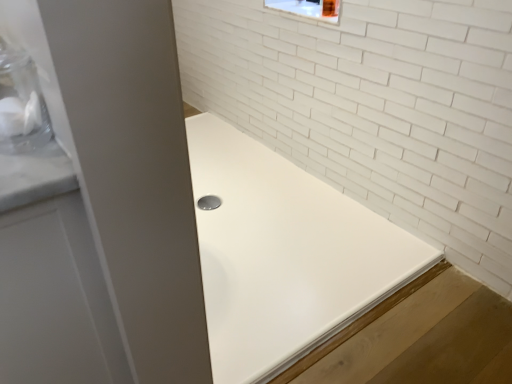
Describe the element at coordinates (19, 115) in the screenshot. The width and height of the screenshot is (512, 384). I see `white matte toilet paper at upper left` at that location.

What is the approximate width of white matte toilet paper at upper left?

white matte toilet paper at upper left is 2.91 inches in width.

Measure the distance between point (22, 123) and camera.

Point (22, 123) is 71.10 centimeters away from camera.

Where is `white matte toilet paper at upper left`? white matte toilet paper at upper left is located at coordinates (19, 115).

The image size is (512, 384). Find the location of `white matte toilet paper at upper left`. white matte toilet paper at upper left is located at coordinates (19, 115).